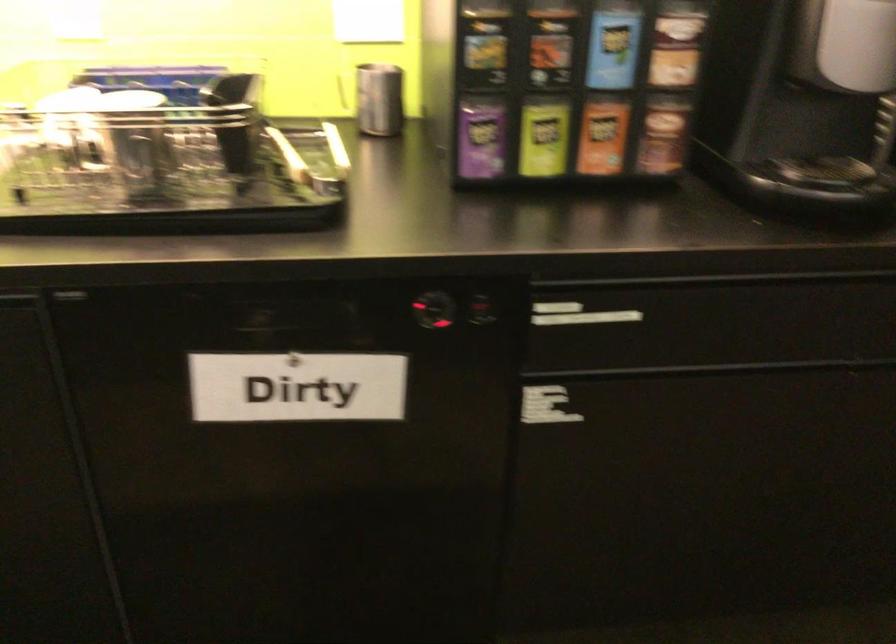
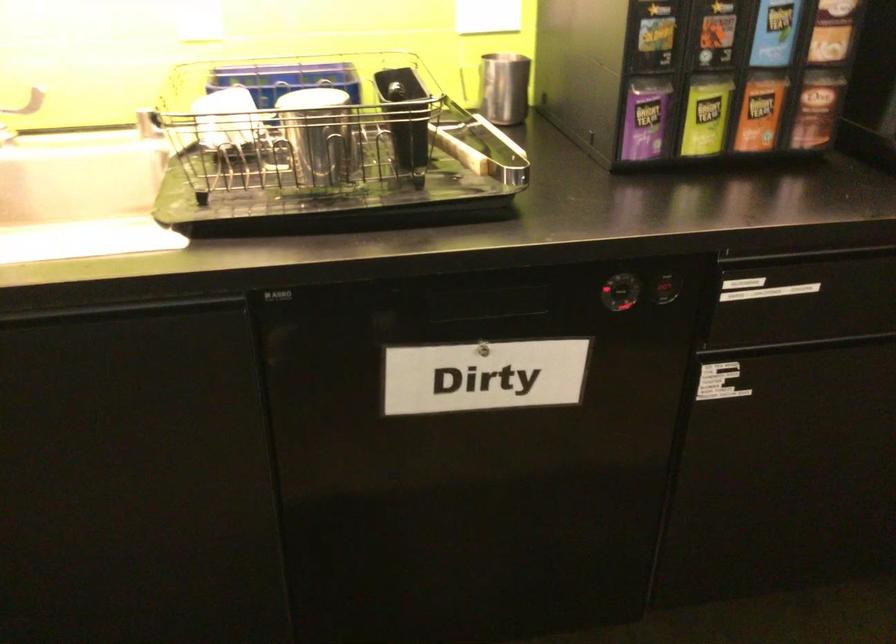
Locate, in the second image, the point that corresponds to the point at 544,137 in the first image.

(705, 116)